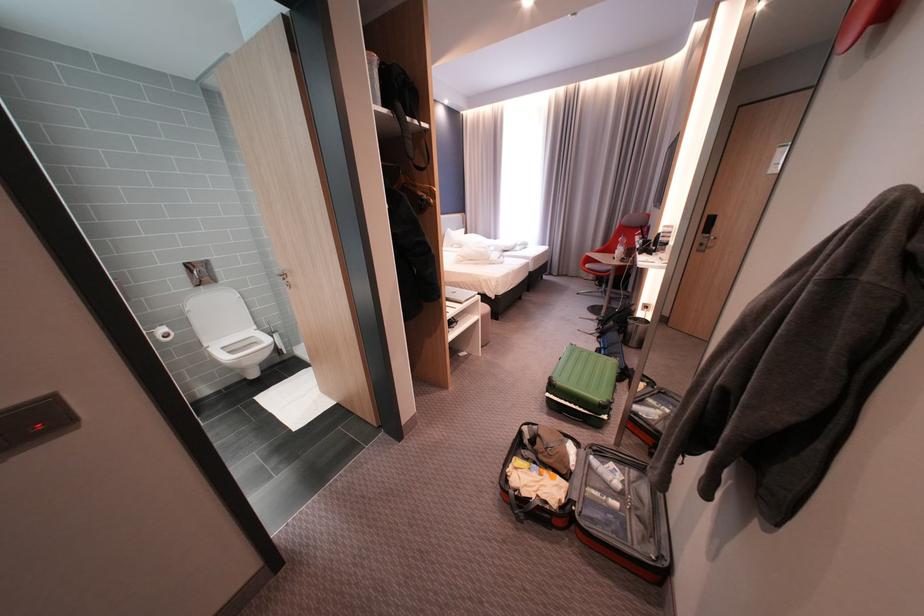
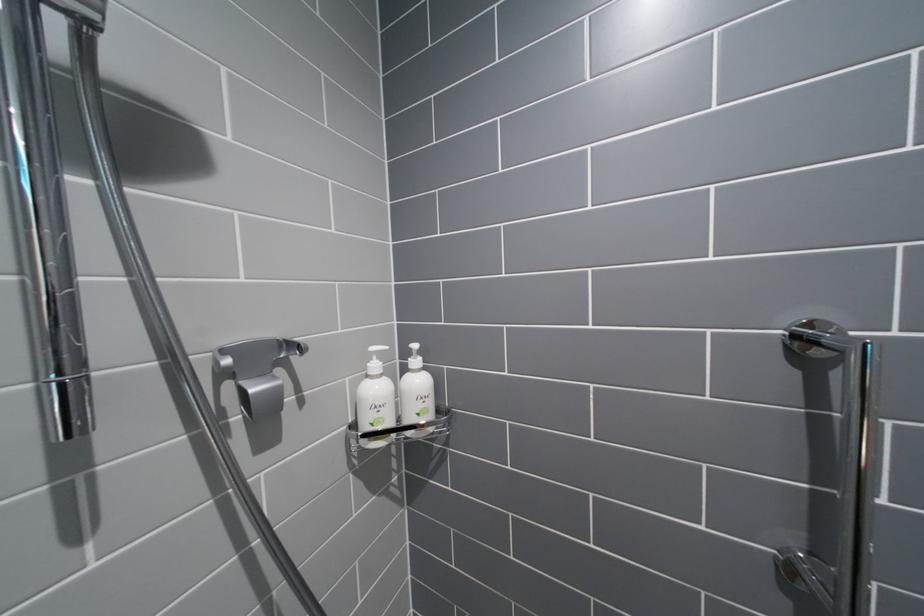
What movement of the cameraman would produce the second image?

The cameraman walked toward left, forward.